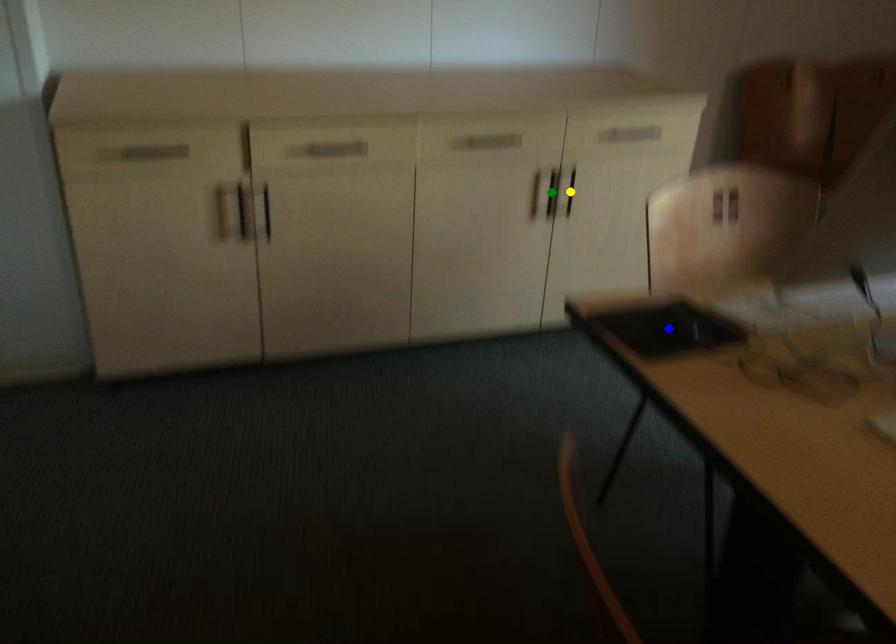
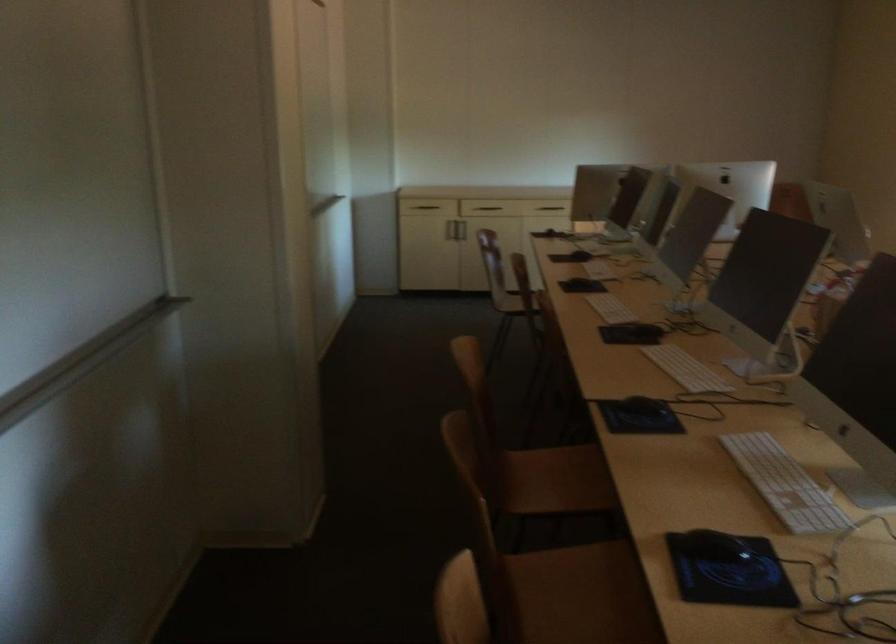
I am providing you with two images of the same scene from different viewpoints. Three points are marked in image1. Which point corresponds to a part or object that is occluded in image2?In image1, three points are marked. Which of them correspond to a part or object that is occluded in image2?Among the three points shown in image1, which one corresponds to a part or object that is no longer visible due to occlusion in image2?

green point, blue point, yellow point